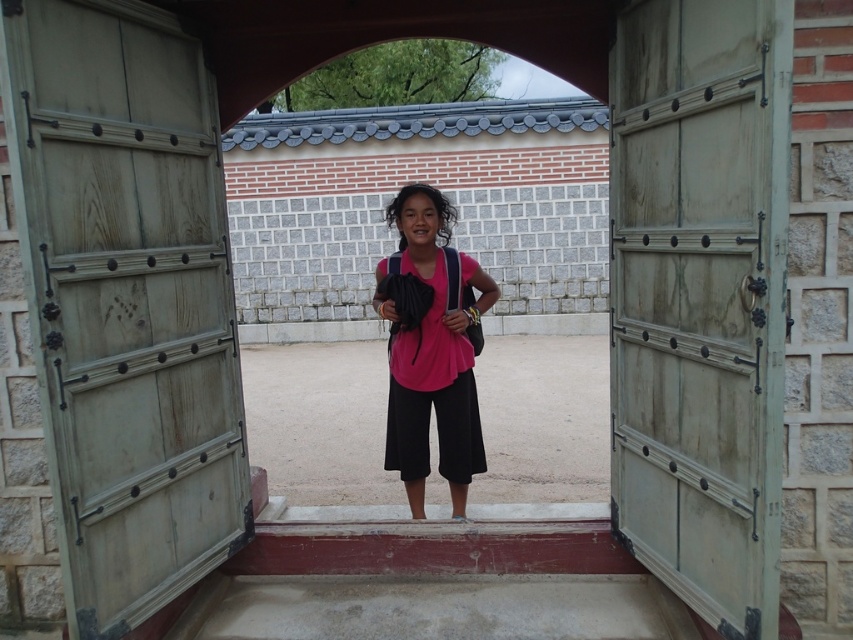
You are standing in front of the building with the large wooden doors. There are two points marked on the doors. The first point is at coordinate (35, 58) and the second point is at (728, 122). If you want to touch the point that is closer to you, which coordinate should you aim for?

The point at coordinate (35, 58) is closer to the viewer, so you should aim for that coordinate.

You are standing in front of the building and want to place a small decoration at the point that is closer to you. Which point should you choose between point (779, 164) and point (465, 314)?

You should choose point (779, 164) because it is closer to the viewer than point (465, 314).